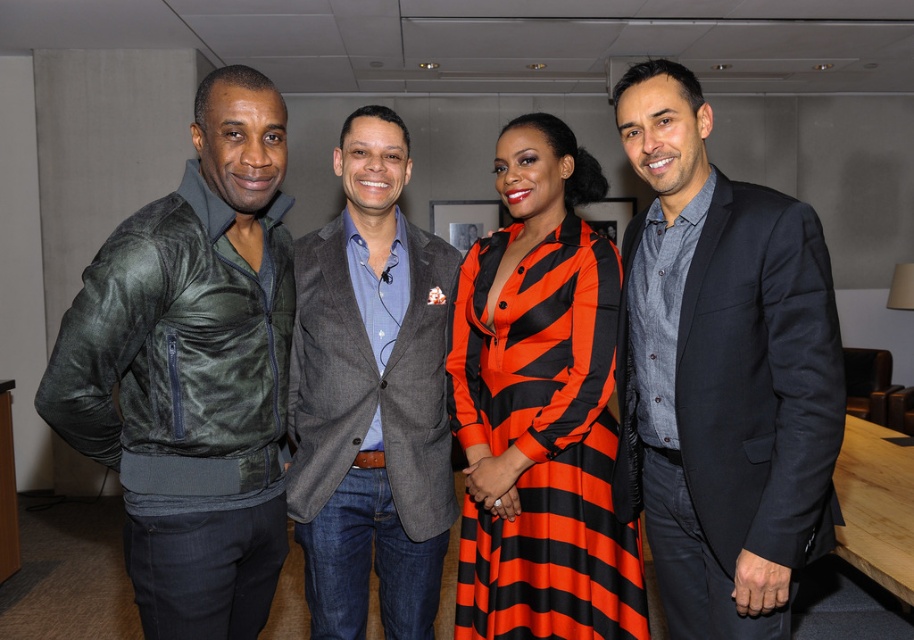
Question: Which object appears farthest from the camera in this image?

Choices:
 (A) green leather jacket at left
 (B) orange-black striped dress at center
 (C) dark blue suit at right
 (D) gray wool blazer at center

Answer: (D)

Question: Is orange-black striped dress at center above gray wool blazer at center?

Choices:
 (A) no
 (B) yes

Answer: (B)

Question: Which point is closer to the camera taking this photo?

Choices:
 (A) (489, 484)
 (B) (703, 195)
 (C) (406, 604)
 (D) (236, 282)

Answer: (D)

Question: Considering the relative positions of dark blue suit at right and green leather jacket at left in the image provided, where is dark blue suit at right located with respect to green leather jacket at left?

Choices:
 (A) below
 (B) above

Answer: (B)

Question: Can you confirm if green leather jacket at left is positioned below orange-black striped dress at center?

Choices:
 (A) yes
 (B) no

Answer: (B)

Question: Which point appears farthest from the camera in this image?

Choices:
 (A) (258, 624)
 (B) (587, 392)

Answer: (B)